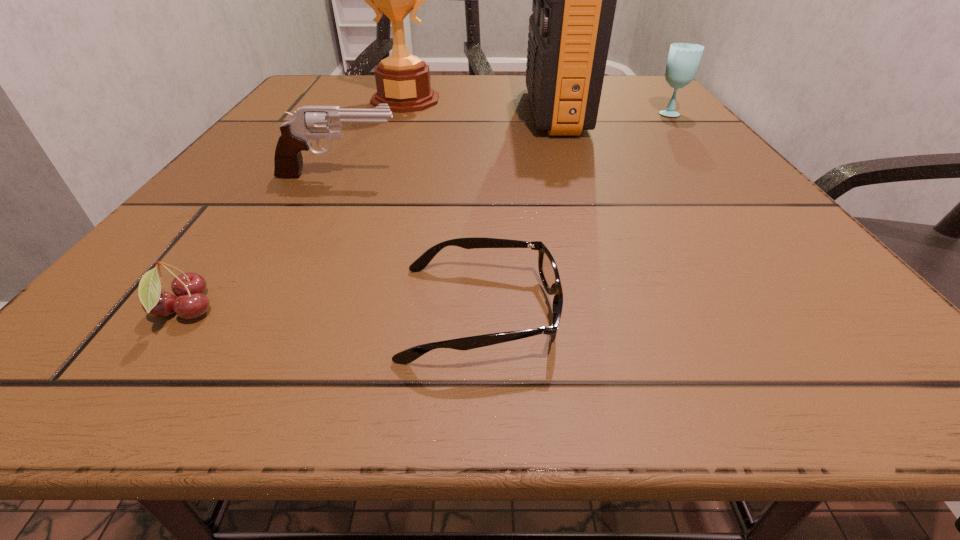
In the image, there is a desktop. Identify the location of vacant space at the far left corner. Image resolution: width=960 pixels, height=540 pixels. (304, 93).

The height and width of the screenshot is (540, 960). Find the location of `vacant space at the far right corner of the desktop`. vacant space at the far right corner of the desktop is located at coordinates (678, 106).

What are the coordinates of `empty space between the glass and the third nearest object` in the screenshot? It's located at (504, 144).

Identify the location of empty space that is in between the radio receiver and the fourth farthest object. This screenshot has width=960, height=540. (446, 144).

You are a GUI agent. You are given a task and a screenshot of the screen. Output one action in this format:
    pyautogui.click(x=<x>, y=<y>)
    Task: Click on the free space between the shortest object and the gun
    The image size is (960, 540).
    Given the screenshot: What is the action you would take?
    pyautogui.click(x=409, y=244)

Locate an element on the screen. The width and height of the screenshot is (960, 540). free space between the shortest object and the second object from right to left is located at coordinates (516, 212).

At what (x,y) coordinates should I click in order to perform the action: click on free space between the glass and the spectacles. Please return your answer as a coordinate pair (x, y). Looking at the image, I should click on (574, 213).

You are a GUI agent. You are given a task and a screenshot of the screen. Output one action in this format:
    pyautogui.click(x=<x>, y=<y>)
    Task: Click on the free spot between the rightmost object and the spectacles
    The height and width of the screenshot is (540, 960).
    Given the screenshot: What is the action you would take?
    pyautogui.click(x=574, y=213)

Identify the location of free space between the third nearest object and the award. The image size is (960, 540). (372, 138).

You are a GUI agent. You are given a task and a screenshot of the screen. Output one action in this format:
    pyautogui.click(x=<x>, y=<y>)
    Task: Click on the unoccupied position between the gun and the fifth object from left to right
    The height and width of the screenshot is (540, 960).
    Given the screenshot: What is the action you would take?
    pyautogui.click(x=446, y=144)